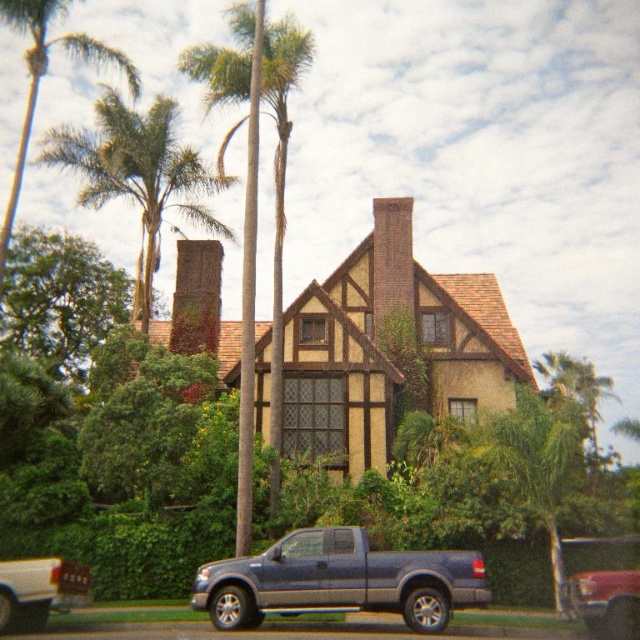
At what (x,y) coordinates should I click in order to perform the action: click on green leafy palm tree at upper center. Please return your answer as a coordinate pair (x, y). The width and height of the screenshot is (640, 640). Looking at the image, I should click on (138, 176).

Which is in front, point (86, 166) or point (577, 394)?

Point (86, 166)

Between point (93, 189) and point (604, 394), which one is positioned behind?

The point (604, 394) is behind.

Locate an element on the screen. green leafy palm tree at upper center is located at coordinates (138, 176).

Does brick chimney at center appear on the right side of green leafy palm tree at upper right?

No, brick chimney at center is not to the right of green leafy palm tree at upper right.

Is brick chimney at center wider than green leafy palm tree at upper right?

Incorrect, brick chimney at center's width does not surpass green leafy palm tree at upper right's.

Is point (412, 285) behind point (596, 451)?

Yes, it is behind point (596, 451).

Find the location of a particular element. This screenshot has height=640, width=640. brick chimney at center is located at coordinates (392, 260).

The height and width of the screenshot is (640, 640). Describe the element at coordinates (138, 176) in the screenshot. I see `green leafy palm tree at upper center` at that location.

Looking at this image, is green leafy palm tree at upper center thinner than white matte truck at lower left?

No, green leafy palm tree at upper center is not thinner than white matte truck at lower left.

Where is `green leafy palm tree at upper center`? green leafy palm tree at upper center is located at coordinates (138, 176).